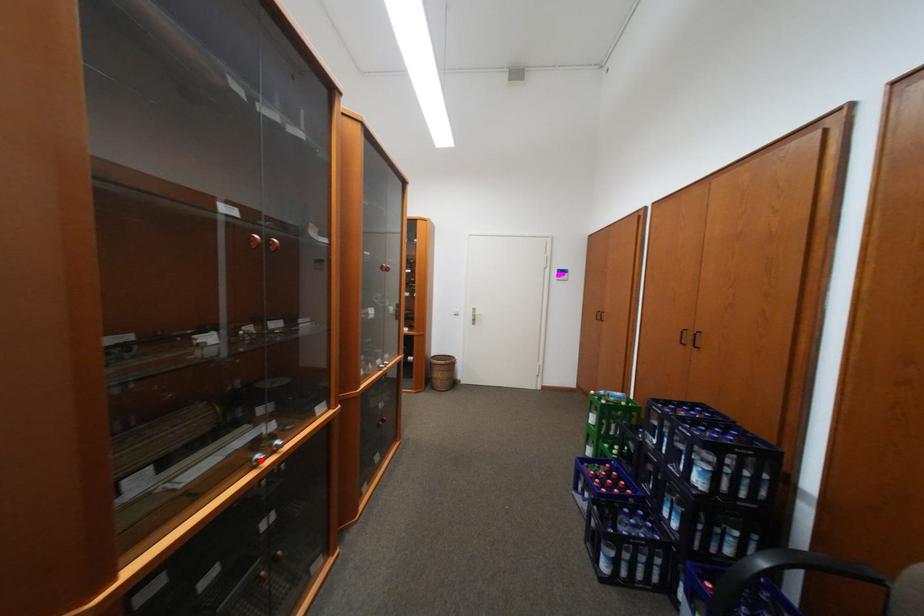
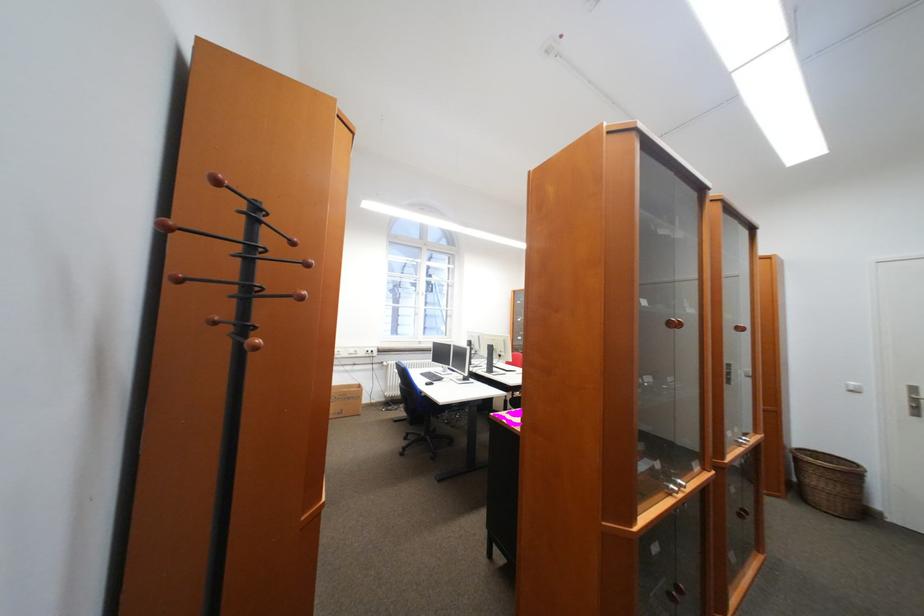
Locate, in the second image, the point that corresponds to the highlighted location in the first image.

(676, 487)